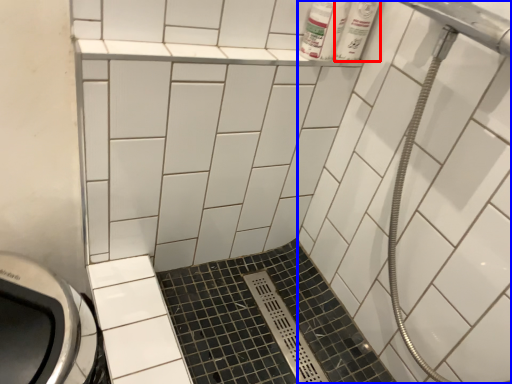
Question: Which object appears closest to the camera in this image, toiletry (highlighted by a red box) or bath (highlighted by a blue box)?

Choices:
 (A) toiletry
 (B) bath

Answer: (B)